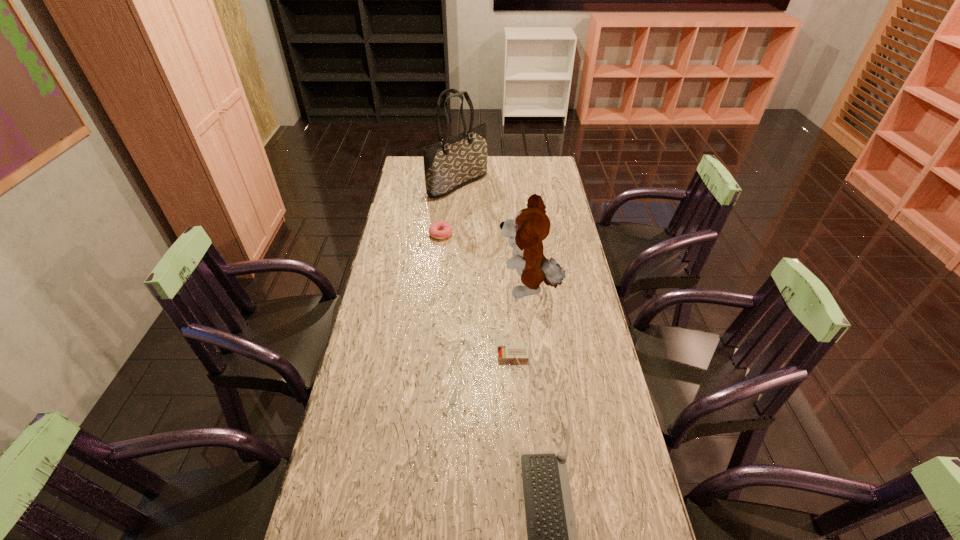
This screenshot has height=540, width=960. I want to click on vacant space at the right edge, so click(x=607, y=375).

Where is `vacant region at the far left corner of the desktop`? vacant region at the far left corner of the desktop is located at coordinates (422, 170).

I want to click on free space between the fourth shortest object and the tote bag, so click(x=493, y=237).

Locate an element on the screen. This screenshot has height=540, width=960. vacant area between the second nearest object and the tote bag is located at coordinates [x=486, y=272].

Locate an element on the screen. The height and width of the screenshot is (540, 960). empty location between the third nearest object and the farthest object is located at coordinates (493, 237).

Locate an element on the screen. This screenshot has height=540, width=960. vacant region between the tallest object and the second tallest object is located at coordinates point(493,237).

Where is `empty location between the second farthest object and the farthest object`? The image size is (960, 540). empty location between the second farthest object and the farthest object is located at coordinates (449, 209).

Locate an element on the screen. vacant area between the second nearest object and the puppy is located at coordinates pos(521,324).

You are a GUI agent. You are given a task and a screenshot of the screen. Output one action in this format:
    pyautogui.click(x=<x>, y=<y>)
    Task: Click on the fourth closest object to the nearest object
    
    Given the screenshot: What is the action you would take?
    pyautogui.click(x=450, y=164)

Select which object appears as the fourth closest to the second nearest object. Please provide its 2D coordinates. Your answer should be formatted as a tuple, i.e. [(x, y)], where the tuple contains the x and y coordinates of a point satisfying the conditions above.

[(450, 164)]